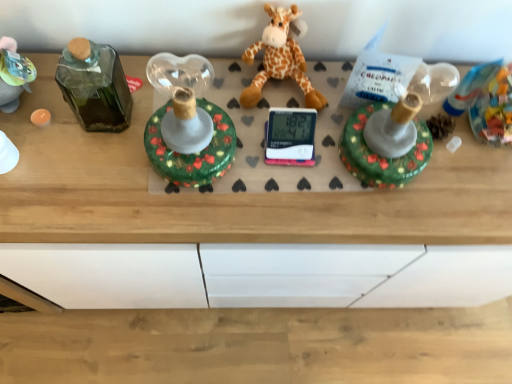
I want to click on vacant area that lies in front of soft plush giraffe at center, so tap(284, 168).